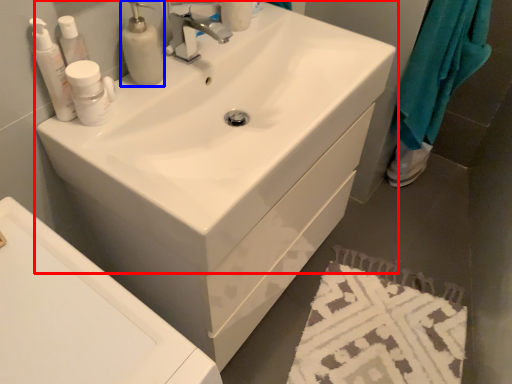
Question: Among these objects, which one is farthest to the camera, sink (highlighted by a red box) or soap dispenser (highlighted by a blue box)?

Choices:
 (A) sink
 (B) soap dispenser

Answer: (B)